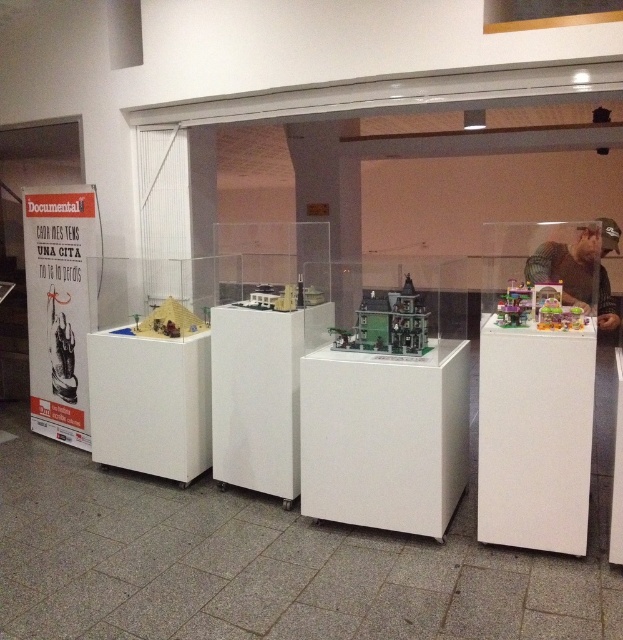
Question: Which object is farther from the camera taking this photo?

Choices:
 (A) white glossy display case at center
 (B) green mesh shirt at upper right

Answer: (A)

Question: Which object appears closest to the camera in this image?

Choices:
 (A) green mesh shirt at upper right
 (B) white glossy display case at center

Answer: (A)

Question: Can you confirm if white glossy display case at center is wider than green mesh shirt at upper right?

Choices:
 (A) no
 (B) yes

Answer: (A)

Question: Where is white glossy display case at center located in relation to green mesh shirt at upper right in the image?

Choices:
 (A) left
 (B) right

Answer: (A)

Question: Does white glossy display case at center have a greater width compared to green mesh shirt at upper right?

Choices:
 (A) yes
 (B) no

Answer: (B)